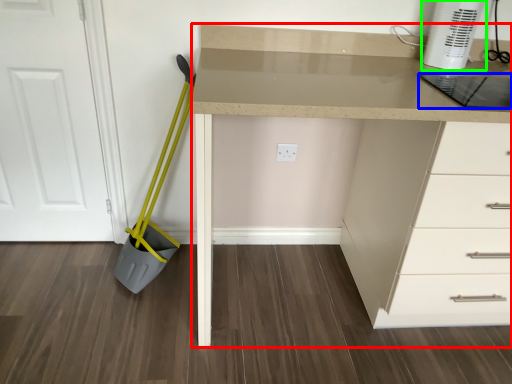
Question: Which object is positioned closest to computer desk (highlighted by a red box)? Select from kitchen appliance (highlighted by a blue box) and home appliance (highlighted by a green box).

Choices:
 (A) kitchen appliance
 (B) home appliance

Answer: (A)